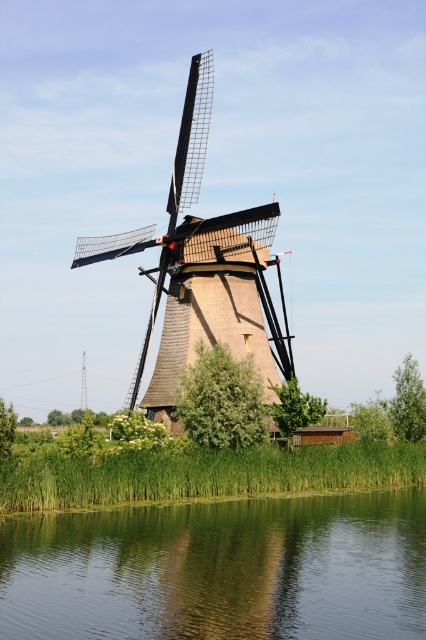
You are standing at the point closer to the water in the scene with the windmill. You want to walk towards the windmill. Which point will you pass first, point (218, 292) or point (57, 490)?

You will pass point (57, 490) first because it is closer to you than point (218, 292), which is behind it.

You are standing at the edge of the green grass at lower center and want to step onto the green smooth water at lower center. Is this possible?

The green smooth water at lower center is positioned under green grass at lower center, so you cannot step onto it because the water is located beneath the grass.